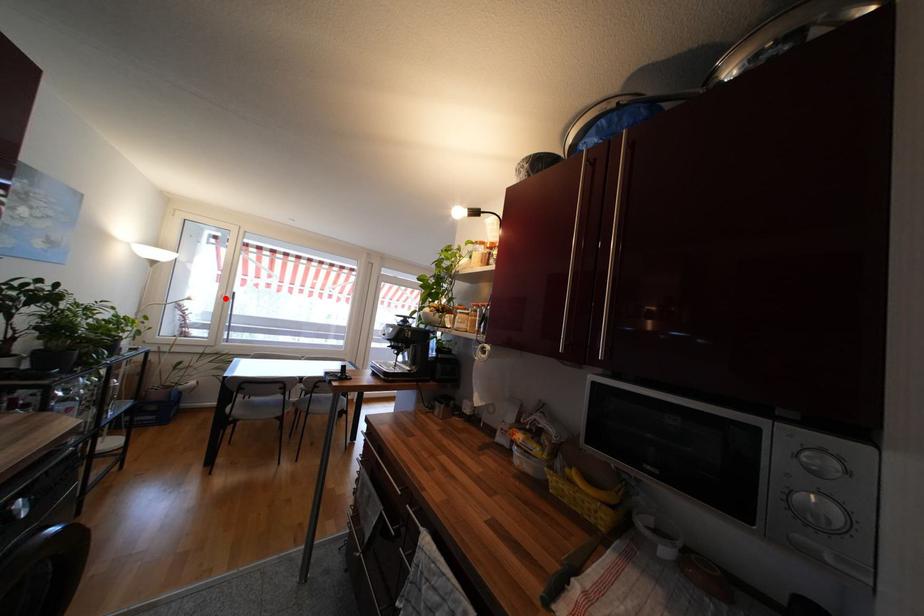
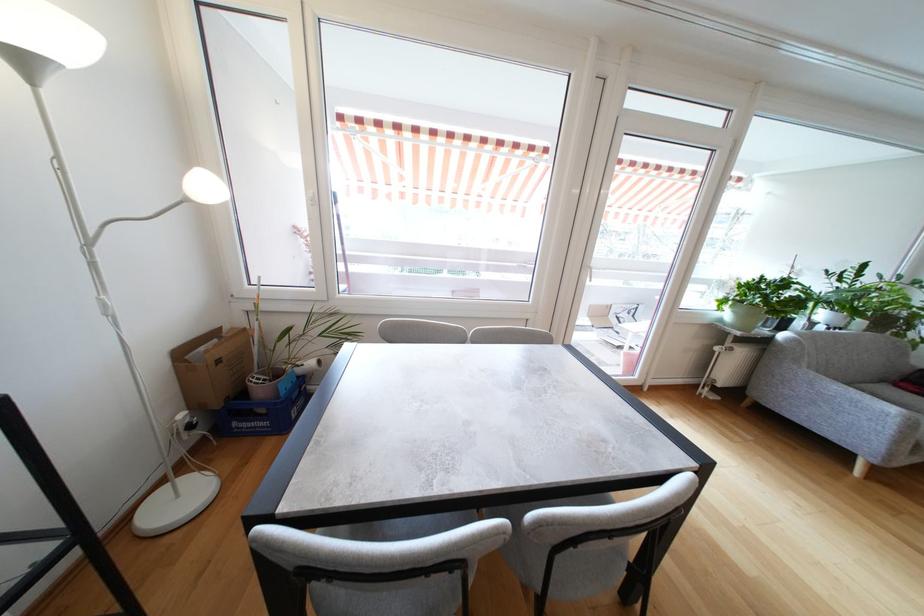
Locate, in the second image, the point that corresponds to the highlighted location in the first image.

(315, 201)